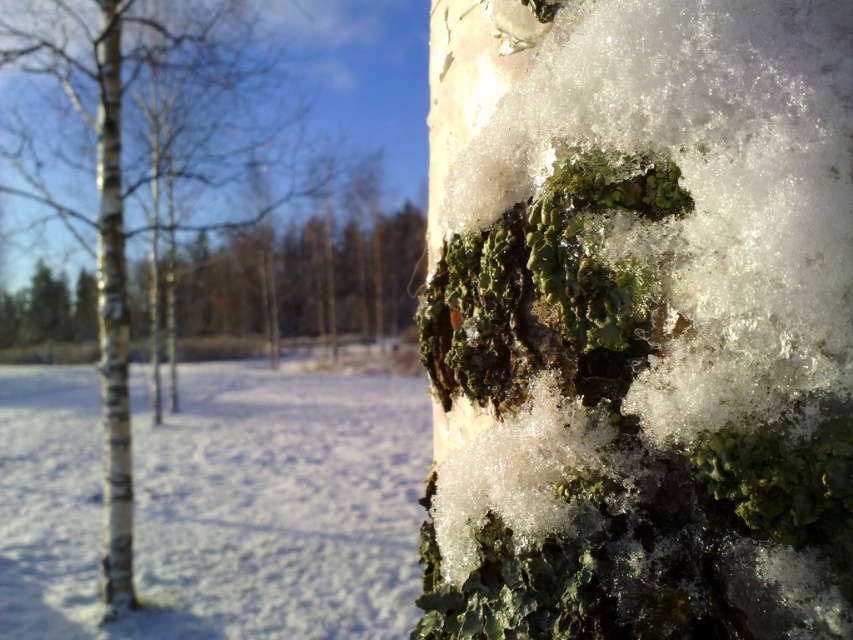
Does white matte bark at center have a larger size compared to white bark tree trunk at left?

Yes.

Can you confirm if white matte bark at center is positioned to the right of white bark tree trunk at left?

Indeed, white matte bark at center is positioned on the right side of white bark tree trunk at left.

Does point (129, 477) lie behind point (103, 486)?

No, it is in front of (103, 486).

You are a GUI agent. You are given a task and a screenshot of the screen. Output one action in this format:
    pyautogui.click(x=<x>, y=<y>)
    Task: Click on the white matte bark at center
    The height and width of the screenshot is (640, 853).
    Given the screenshot: What is the action you would take?
    pyautogui.click(x=129, y=161)